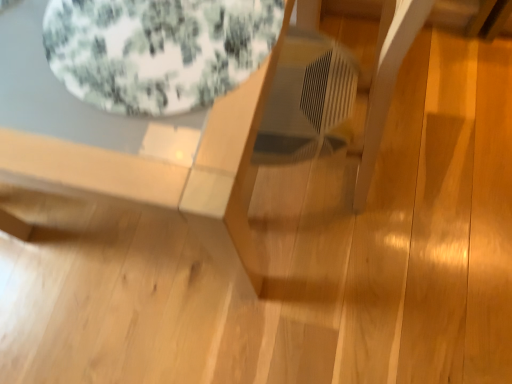
Identify the location of free point above floral fabric bean bag at upper left (from a real-world perspective). This screenshot has width=512, height=384. (153, 41).